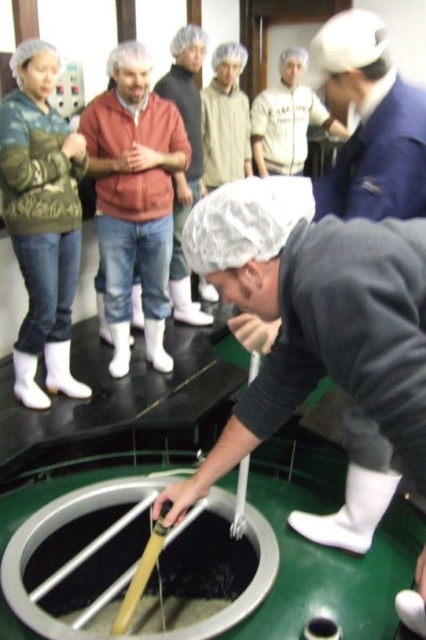
Question: Does camouflage-patterned jacket at upper left appear under white hairnet at center?

Choices:
 (A) yes
 (B) no

Answer: (A)

Question: Is camouflage-patterned jacket at upper left closer to the viewer compared to matte orange jacket at center?

Choices:
 (A) yes
 (B) no

Answer: (A)

Question: Which point appears farthest from the camera in this image?

Choices:
 (A) (350, 22)
 (B) (284, 161)

Answer: (B)

Question: Can you confirm if camouflage-patterned jacket at upper left is wider than matte orange jacket at center?

Choices:
 (A) yes
 (B) no

Answer: (B)

Question: Which point is farther to the camera?

Choices:
 (A) matte orange jacket at center
 (B) white hairnet at center
 (C) camouflage-patterned jacket at upper left

Answer: (B)

Question: Considering the real-world distances, which object is farthest from the white matte hairnet at center?

Choices:
 (A) matte orange jacket at center
 (B) camouflage-patterned jacket at upper left
 (C) white matte hard hat at upper center

Answer: (A)